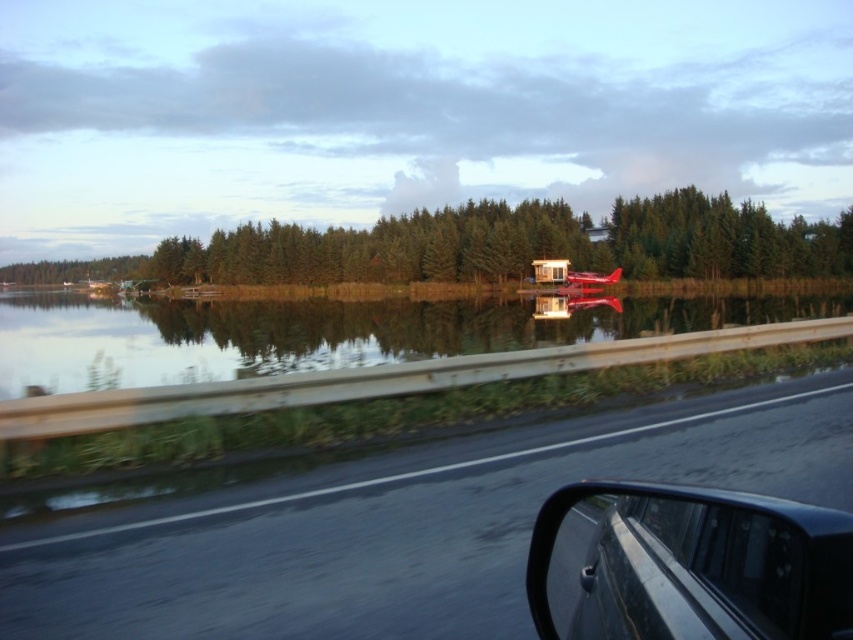
Question: Does black asphalt highway at center appear on the left side of metallic red airplane at center?

Choices:
 (A) yes
 (B) no

Answer: (A)

Question: Can you confirm if black asphalt highway at center is bigger than smooth water at center?

Choices:
 (A) yes
 (B) no

Answer: (B)

Question: In this image, where is black asphalt highway at center located relative to black glossy car at lower right?

Choices:
 (A) below
 (B) above

Answer: (A)

Question: Which of the following is the closest to the observer?

Choices:
 (A) green matte trees at center
 (B) smooth water at center

Answer: (B)

Question: Among these points, which one is farthest from the camera?

Choices:
 (A) pyautogui.click(x=106, y=259)
 (B) pyautogui.click(x=579, y=579)

Answer: (A)

Question: Which of the following is the closest to the observer?

Choices:
 (A) (619, 276)
 (B) (675, 604)

Answer: (B)